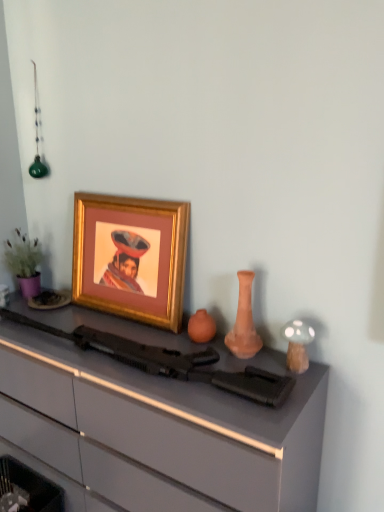
Locate an element on the screen. This screenshot has width=384, height=512. vacant space situated above matte gray desk at center (from a real-world perspective) is located at coordinates (99, 326).